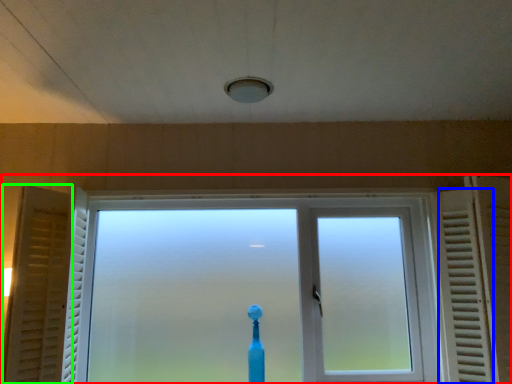
Question: Which is nearer to the window (highlighted by a red box)? radiator (highlighted by a blue box) or curtain (highlighted by a green box).

Choices:
 (A) radiator
 (B) curtain

Answer: (A)